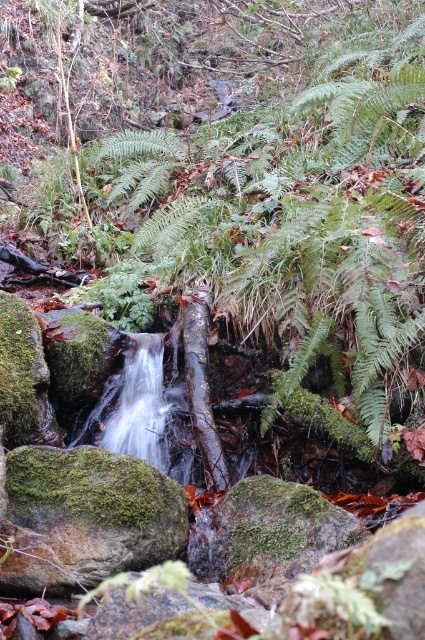
Question: Which object is the farthest from the green mossy rock at lower left?

Choices:
 (A) green mossy rock at center
 (B) clear water at center

Answer: (B)

Question: Among these objects, which one is farthest from the camera?

Choices:
 (A) clear water at center
 (B) green mossy rock at lower left
 (C) green mossy rock at center

Answer: (A)

Question: Which point is closer to the camera taking this photo?

Choices:
 (A) (159, 435)
 (B) (178, 554)
 (C) (329, 516)

Answer: (C)

Question: Can you confirm if green mossy rock at lower left is thinner than clear water at center?

Choices:
 (A) yes
 (B) no

Answer: (B)

Question: Is green mossy rock at lower left positioned at the back of clear water at center?

Choices:
 (A) yes
 (B) no

Answer: (B)

Question: Considering the relative positions of green mossy rock at center and clear water at center in the image provided, where is green mossy rock at center located with respect to clear water at center?

Choices:
 (A) above
 (B) below

Answer: (B)